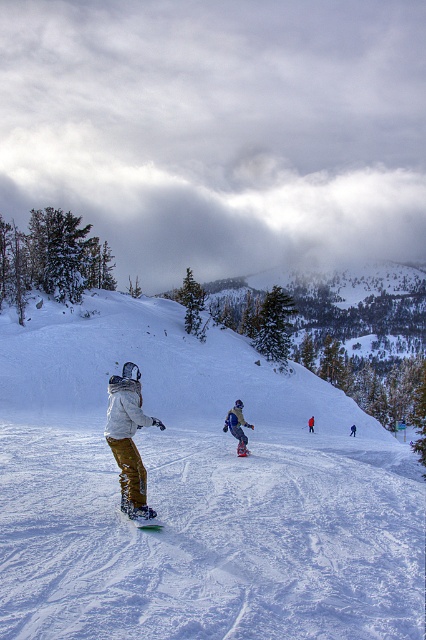
Is point (252, 426) closer to viewer compared to point (117, 508)?

No, it is not.

Is blue snowboard at center thinner than green plastic snowboard at center?

In fact, blue snowboard at center might be wider than green plastic snowboard at center.

Who is more forward, (x=227, y=426) or (x=157, y=525)?

Positioned in front is point (x=157, y=525).

Locate an element on the screen. The width and height of the screenshot is (426, 640). blue snowboard at center is located at coordinates (238, 426).

Can you confirm if matte yellow pants at center is wider than blue snowboard at center?

No, matte yellow pants at center is not wider than blue snowboard at center.

At what (x,y) coordinates should I click in order to perform the action: click on matte yellow pants at center. Please return your answer as a coordinate pair (x, y). Looking at the image, I should click on (129, 440).

Who is more forward, (127, 422) or (238, 449)?

Positioned in front is point (127, 422).

Between point (120, 460) and point (238, 456), which one is positioned behind?

Positioned behind is point (238, 456).

This screenshot has width=426, height=640. In order to click on matte yellow pants at center in this screenshot , I will do `click(129, 440)`.